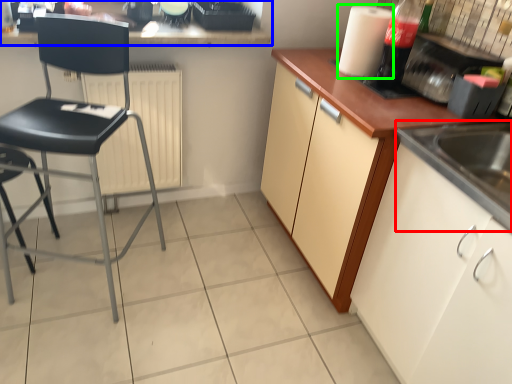
Question: Which is nearer to the sink (highlighted by a red box)? countertop (highlighted by a blue box) or paper towel (highlighted by a green box).

Choices:
 (A) countertop
 (B) paper towel

Answer: (B)